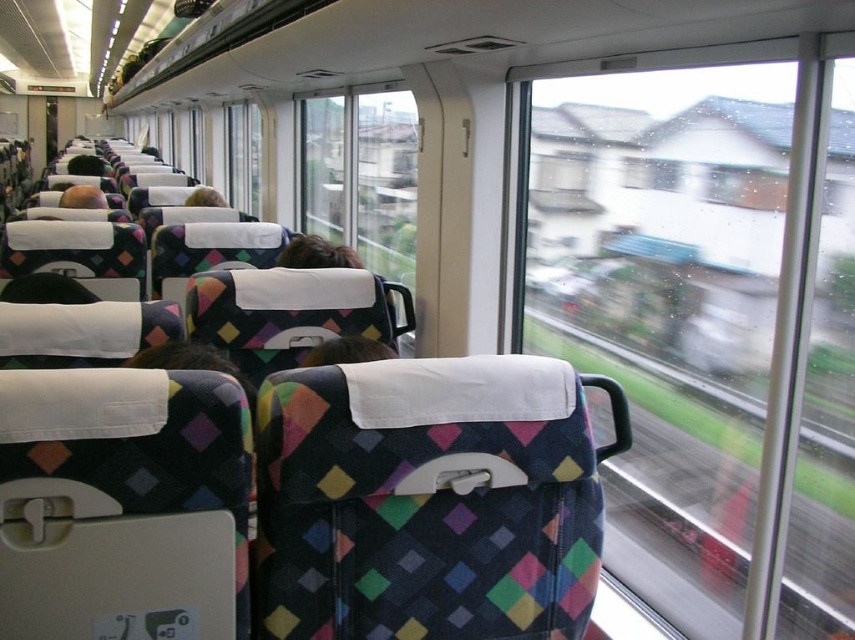
Question: Which point appears closest to the camera in this image?

Choices:
 (A) (99, 192)
 (B) (806, 173)

Answer: (B)

Question: Does transparent glass window at center appear under matte black hair at left?

Choices:
 (A) no
 (B) yes

Answer: (B)

Question: Does transparent glass window at center appear on the right side of matte black hair at left?

Choices:
 (A) no
 (B) yes

Answer: (B)

Question: Which point is closer to the camera?

Choices:
 (A) transparent glass window at center
 (B) matte black hair at left

Answer: (A)

Question: Among these points, which one is nearest to the camera?

Choices:
 (A) (99, 189)
 (B) (549, 99)

Answer: (B)

Question: Is transparent glass window at center wider than matte black hair at left?

Choices:
 (A) no
 (B) yes

Answer: (B)